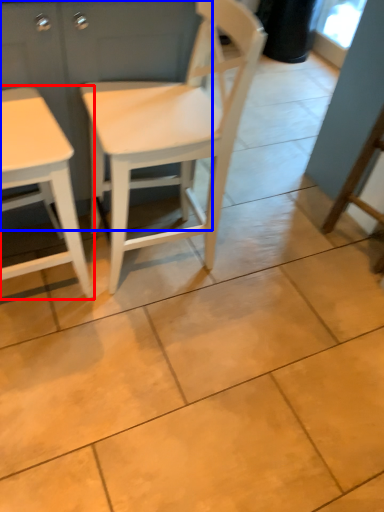
Question: Which of the following is the closest to the observer, table (highlighted by a red box) or dresser (highlighted by a blue box)?

Choices:
 (A) table
 (B) dresser

Answer: (A)